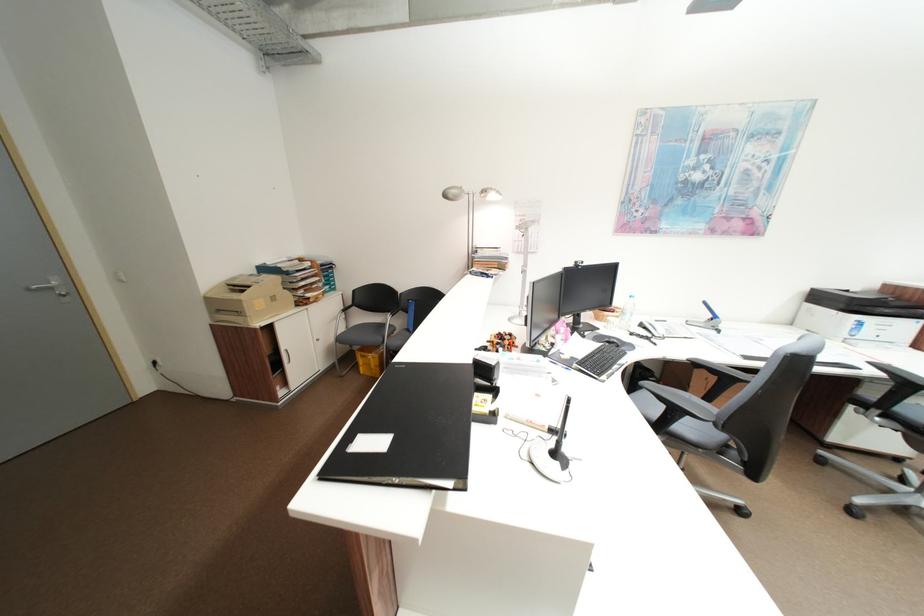
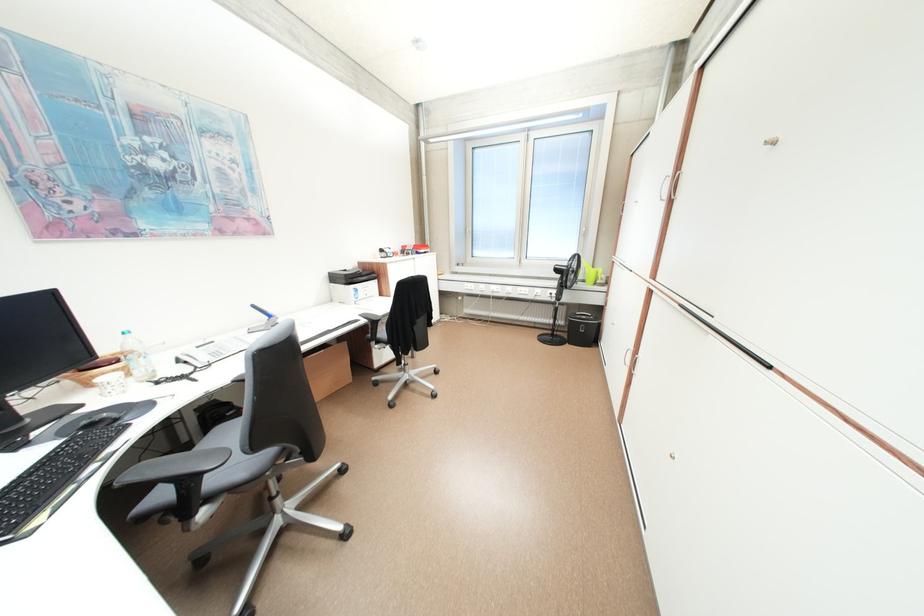
The point at (880, 373) is marked in the first image. Where is the corresponding point in the second image?

(371, 322)